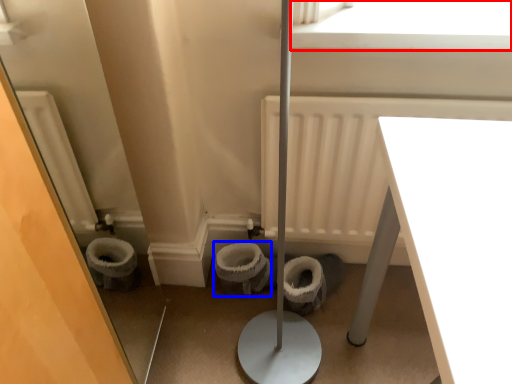
Question: Among these objects, which one is farthest to the camera, window screen (highlighted by a red box) or toilet bowl (highlighted by a blue box)?

Choices:
 (A) window screen
 (B) toilet bowl

Answer: (B)